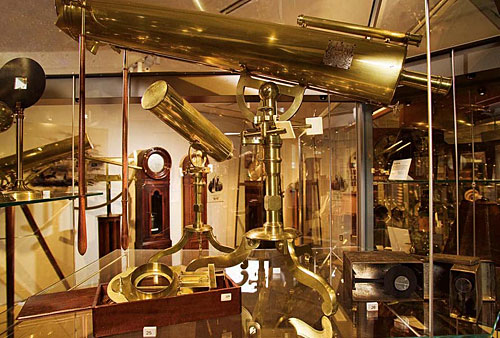
You are a GUI agent. You are given a task and a screenshot of the screen. Output one action in this format:
    pyautogui.click(x=<x>, y=<y>)
    Task: Click on the box lid
    
    Given the screenshot: What is the action you would take?
    pyautogui.click(x=48, y=301)